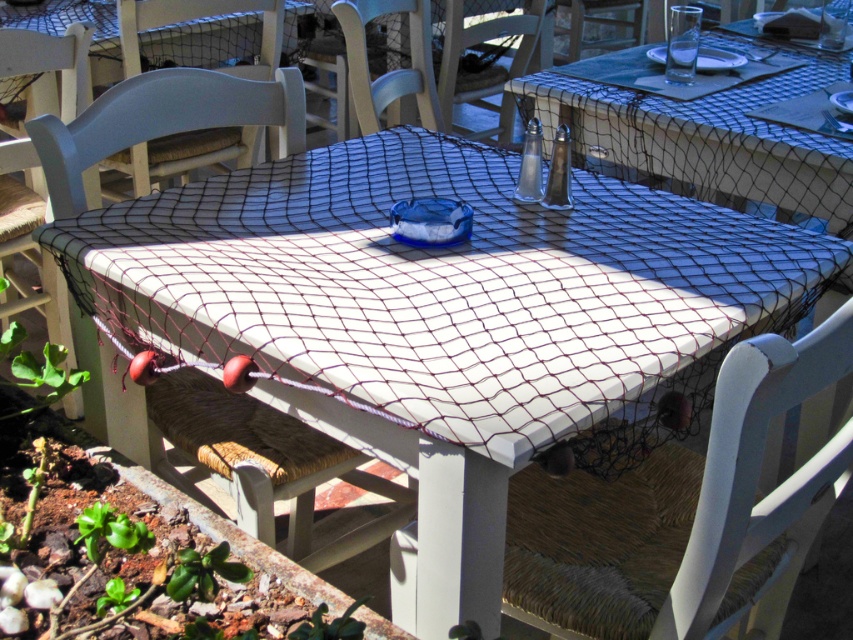
The width and height of the screenshot is (853, 640). Describe the element at coordinates (265, 464) in the screenshot. I see `white wicker chair at center` at that location.

Between point (379, 536) and point (450, 28), which one is positioned in front?

Point (379, 536) is more forward.

Locate an element on the screen. white wicker chair at center is located at coordinates (265, 464).

Which is below, metallic silver salt shaker at upper center or white woven chair at center?

white woven chair at center is below.

Does point (495, 28) come behind point (434, 118)?

Yes, it is behind point (434, 118).

This screenshot has height=640, width=853. In order to click on metallic silver salt shaker at upper center in this screenshot , I will do `click(486, 67)`.

From the picture: Is white wicker chair at center closer to the viewer compared to white wicker chair at upper center?

Yes, white wicker chair at center is closer to the viewer.

Is white wicker chair at center positioned at the back of white wicker chair at upper center?

No, it is not.

Consider the image. Measure the distance between point (42, 131) and camera.

The distance of point (42, 131) from camera is 4.70 feet.

Find the location of `white wicker chair at center`. white wicker chair at center is located at coordinates (265, 464).